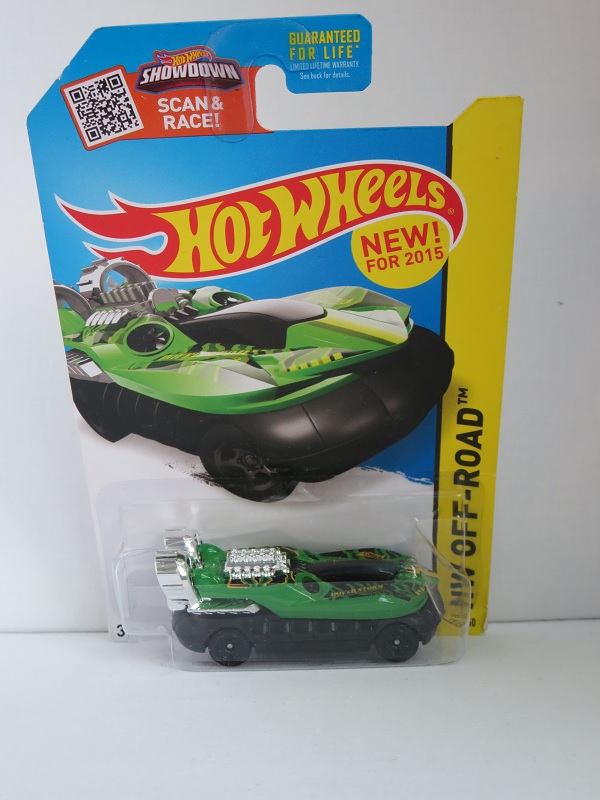
Where is `real toy car`? The image size is (600, 800). real toy car is located at coordinates (294, 604).